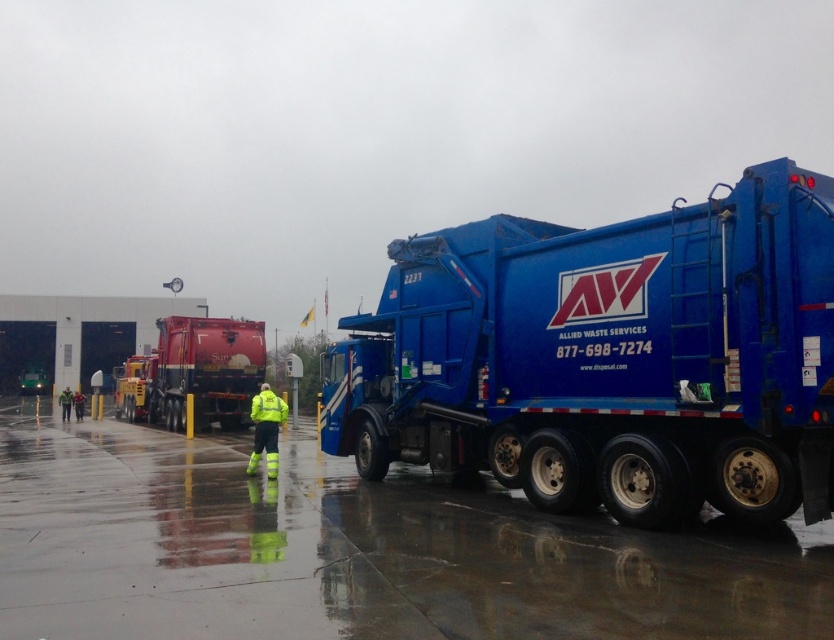
You are standing at the point with coordinates point (252,458) and want to walk to the point with coordinates point (584,506). Which direction should you face to move towards your destination?

You should face north because point (584,506) is in front of point (252,458), indicating it is north of your current position.